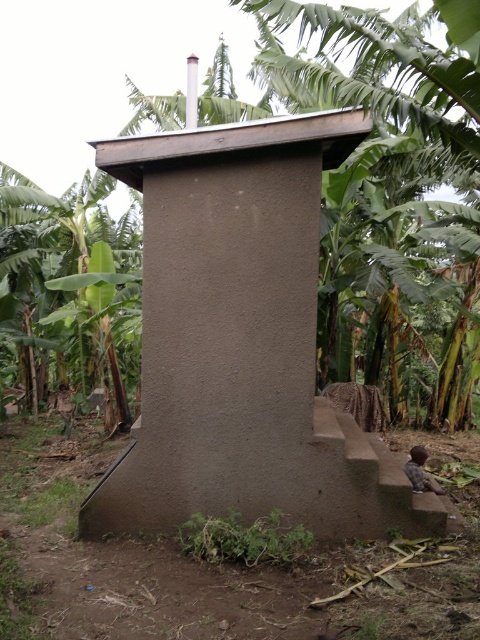
Question: Can you confirm if green leafy banana tree at center is bigger than green leafy plant at left?

Choices:
 (A) yes
 (B) no

Answer: (A)

Question: Does green leafy banana tree at center come in front of green leafy plant at left?

Choices:
 (A) yes
 (B) no

Answer: (A)

Question: Which point is closer to the camera?

Choices:
 (A) green leafy banana tree at center
 (B) green leafy plant at left

Answer: (A)

Question: Does green leafy banana tree at center come behind green leafy plant at left?

Choices:
 (A) yes
 (B) no

Answer: (B)